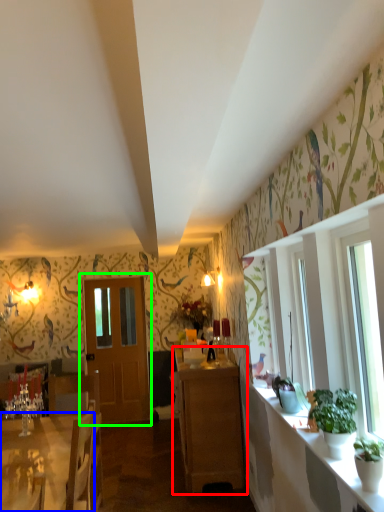
Question: Based on their relative distances, which object is nearer to cabinetry (highlighted by a red box)? Choose from desk (highlighted by a blue box) and door (highlighted by a green box).

Choices:
 (A) desk
 (B) door

Answer: (A)